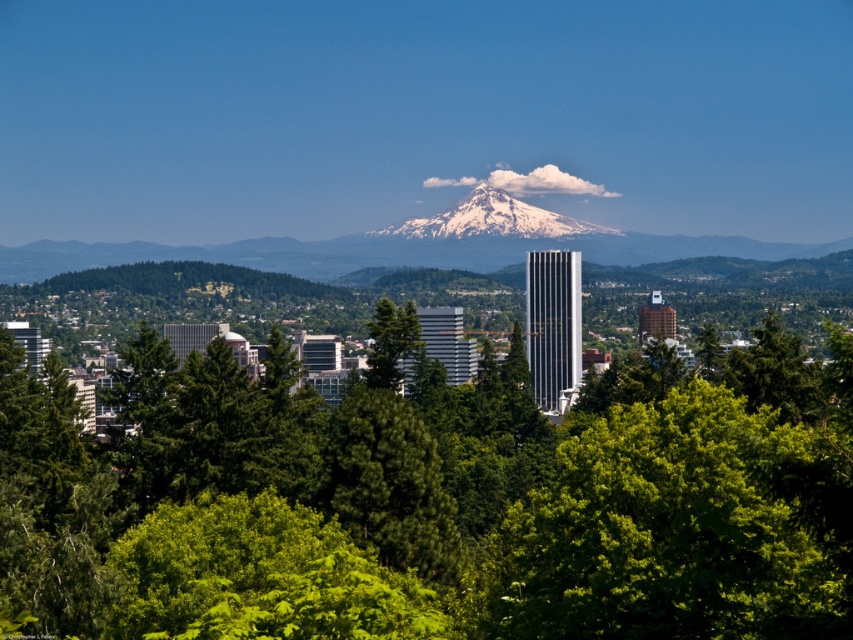
You are an architect designing a new observation deck. You want to ensure that visitors can see both the green leafy tree at center and the snowy peak at center without obstruction. Based on the scene, which object should be placed closer to the observation deck to maintain visibility?

The green leafy tree at center is in front of the snowy peak at center. To ensure both are visible without obstruction, the observation deck should be positioned closer to the green leafy tree at center so that the tree does not block the view of the snowy peak at center behind it.

You are a drone operator who needs to fly a drone from the green leafy tree at center to the snowy peak at center. What is the approximate distance you need to cover?

The distance between the green leafy tree at center and the snowy peak at center is 272.34 feet, so the drone needs to cover approximately 272.34 feet.